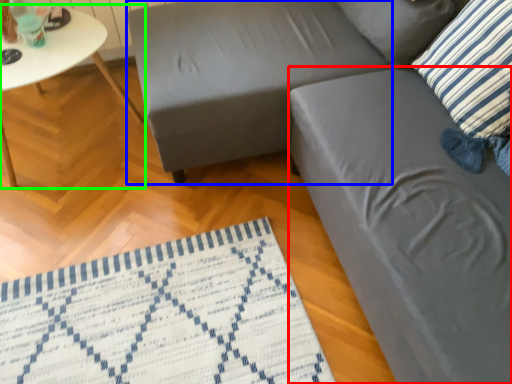
Question: Estimate the real-world distances between objects in this image. Which object is farther from swivel chair (highlighted by a red box), swivel chair (highlighted by a blue box) or table (highlighted by a green box)?

Choices:
 (A) swivel chair
 (B) table

Answer: (B)